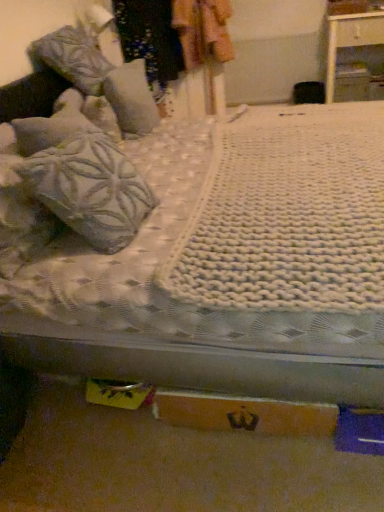
Question: Can you confirm if white knitted blanket at center is bigger than orange cardboard box at lower center?

Choices:
 (A) yes
 (B) no

Answer: (A)

Question: From a real-world perspective, does white knitted blanket at center stand above orange cardboard box at lower center?

Choices:
 (A) no
 (B) yes

Answer: (B)

Question: Is white knitted blanket at center completely or partially outside of orange cardboard box at lower center?

Choices:
 (A) yes
 (B) no

Answer: (A)

Question: Can you confirm if white knitted blanket at center is smaller than orange cardboard box at lower center?

Choices:
 (A) yes
 (B) no

Answer: (B)

Question: From a real-world perspective, is white knitted blanket at center beneath orange cardboard box at lower center?

Choices:
 (A) no
 (B) yes

Answer: (A)

Question: Considering their positions, is orange cardboard box at lower center located in front of or behind patterned fabric at upper center?

Choices:
 (A) behind
 (B) front

Answer: (B)

Question: Considering the relative positions of orange cardboard box at lower center and patterned fabric at upper center in the image provided, is orange cardboard box at lower center to the left or to the right of patterned fabric at upper center?

Choices:
 (A) left
 (B) right

Answer: (B)

Question: Considering the positions of orange cardboard box at lower center and patterned fabric at upper center in the image, is orange cardboard box at lower center wider or thinner than patterned fabric at upper center?

Choices:
 (A) thin
 (B) wide

Answer: (A)

Question: From the image's perspective, is orange cardboard box at lower center positioned above or below patterned fabric at upper center?

Choices:
 (A) below
 (B) above

Answer: (A)

Question: Considering the positions of white glossy nightstand at upper right and textured gray pillow at upper left, which is the first pillow from back to front, in the image, is white glossy nightstand at upper right taller or shorter than textured gray pillow at upper left, which is the first pillow from back to front,?

Choices:
 (A) short
 (B) tall

Answer: (B)

Question: From a real-world perspective, relative to textured gray pillow at upper left, which is the 2th pillow from front to back, is white glossy nightstand at upper right vertically above or below?

Choices:
 (A) below
 (B) above

Answer: (A)

Question: Is white glossy nightstand at upper right bigger or smaller than textured gray pillow at upper left, which is the 2th pillow from front to back?

Choices:
 (A) small
 (B) big

Answer: (B)

Question: Is white glossy nightstand at upper right in front of or behind textured gray pillow at upper left, which is the first pillow from back to front, in the image?

Choices:
 (A) front
 (B) behind

Answer: (B)

Question: Considering the relative positions of textured gray pillow at upper left, which is the 2th pillow from front to back, and patterned fabric at upper center in the image provided, is textured gray pillow at upper left, which is the 2th pillow from front to back, to the left or to the right of patterned fabric at upper center?

Choices:
 (A) left
 (B) right

Answer: (A)

Question: From the image's perspective, is textured gray pillow at upper left, which is the 2th pillow from front to back, above or below patterned fabric at upper center?

Choices:
 (A) below
 (B) above

Answer: (A)